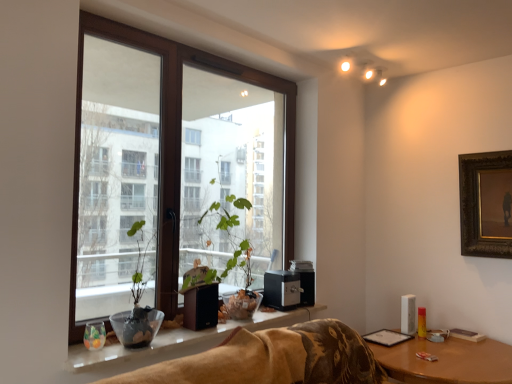
Image resolution: width=512 pixels, height=384 pixels. I want to click on vacant space situated above brown wooden table at lower right (from a real-world perspective), so click(x=435, y=343).